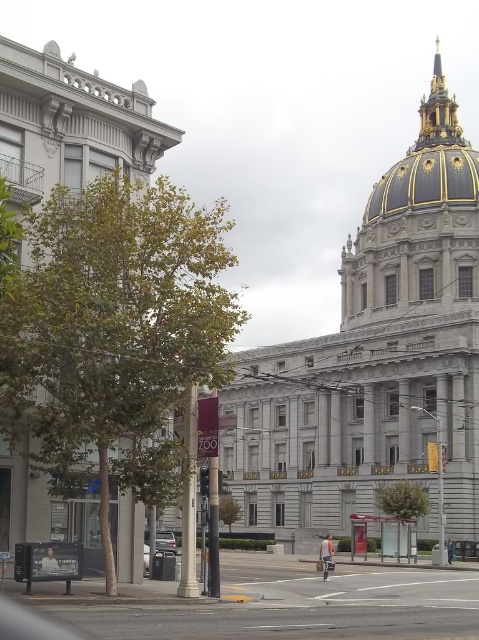
Question: Does gold/gilded stone spire at upper right lie behind metallic silver car at lower center?

Choices:
 (A) no
 (B) yes

Answer: (B)

Question: Which object is closer to the camera taking this photo?

Choices:
 (A) gold/gilded dome at upper right
 (B) gold/gilded stone spire at upper right
 (C) metallic silver car at lower center

Answer: (C)

Question: Does gold/gilded dome at upper right have a larger size compared to metallic silver car at lower center?

Choices:
 (A) no
 (B) yes

Answer: (B)

Question: Which object is farther from the camera taking this photo?

Choices:
 (A) gold/gilded dome at upper right
 (B) metallic silver car at lower center
 (C) gold/gilded stone spire at upper right

Answer: (C)

Question: Based on their relative distances, which object is nearer to the gold/gilded dome at upper right?

Choices:
 (A) metallic silver car at lower center
 (B) gold/gilded stone spire at upper right

Answer: (B)

Question: From the image, what is the correct spatial relationship of gold/gilded stone spire at upper right in relation to metallic silver car at lower center?

Choices:
 (A) left
 (B) right

Answer: (B)